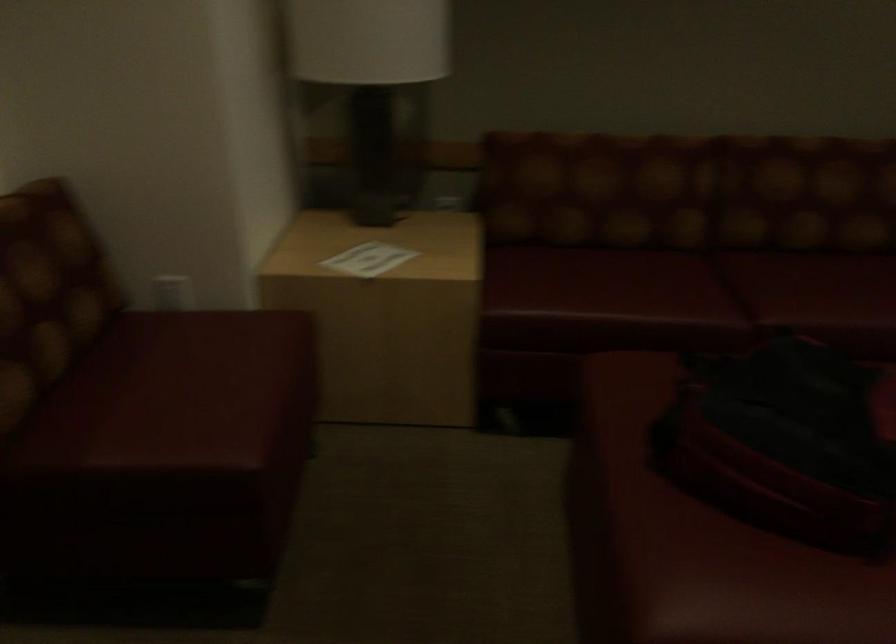
What do you see at coordinates (698, 286) in the screenshot? Image resolution: width=896 pixels, height=644 pixels. I see `a red sofa sitting surface` at bounding box center [698, 286].